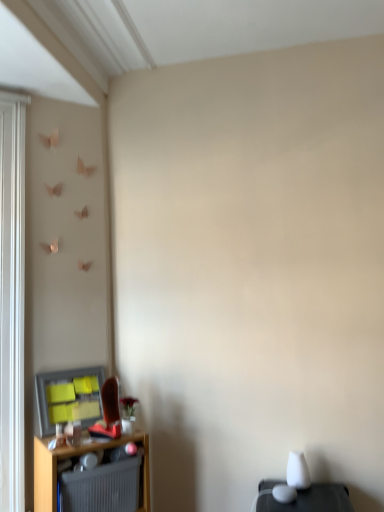
You are a GUI agent. You are given a task and a screenshot of the screen. Output one action in this format:
    pyautogui.click(x=<x>, y=<y>)
    Task: Click on the empty space that is ontop of gray ribbed radiator at lower left (from a real-world perspective)
    
    Given the screenshot: What is the action you would take?
    pyautogui.click(x=89, y=464)